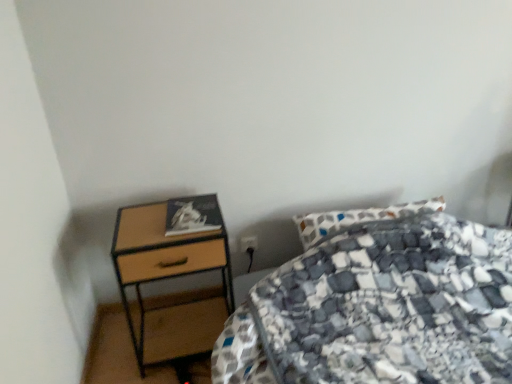
Question: Is patterned fabric bed at center next to black plastic power plug at lower center?

Choices:
 (A) no
 (B) yes

Answer: (A)

Question: Does patterned fabric bed at center appear on the left side of black plastic power plug at lower center?

Choices:
 (A) yes
 (B) no

Answer: (B)

Question: Does patterned fabric bed at center have a lesser width compared to black plastic power plug at lower center?

Choices:
 (A) yes
 (B) no

Answer: (B)

Question: Considering the relative sizes of patterned fabric bed at center and black plastic power plug at lower center in the image provided, is patterned fabric bed at center wider than black plastic power plug at lower center?

Choices:
 (A) no
 (B) yes

Answer: (B)

Question: Can you confirm if patterned fabric bed at center is smaller than black plastic power plug at lower center?

Choices:
 (A) no
 (B) yes

Answer: (A)

Question: Considering the positions of point [x=181, y=253] and point [x=241, y=243], is point [x=181, y=253] closer or farther from the camera than point [x=241, y=243]?

Choices:
 (A) farther
 (B) closer

Answer: (B)

Question: In terms of width, does woodenmaterial/texturenightstand at left look wider or thinner when compared to black plastic power plug at lower center?

Choices:
 (A) wide
 (B) thin

Answer: (A)

Question: Visually, is woodenmaterial/texturenightstand at left positioned to the left or to the right of black plastic power plug at lower center?

Choices:
 (A) left
 (B) right

Answer: (A)

Question: Is woodenmaterial/texturenightstand at left inside or outside of black plastic power plug at lower center?

Choices:
 (A) outside
 (B) inside

Answer: (A)

Question: Relative to patterned fabric bed at center, is black plastic power plug at lower center in front or behind?

Choices:
 (A) behind
 (B) front

Answer: (A)

Question: From the image's perspective, is black plastic power plug at lower center above or below patterned fabric bed at center?

Choices:
 (A) below
 (B) above

Answer: (B)

Question: Choose the correct answer: Is black plastic power plug at lower center inside patterned fabric bed at center or outside it?

Choices:
 (A) outside
 (B) inside

Answer: (A)

Question: In terms of width, does black plastic power plug at lower center look wider or thinner when compared to patterned fabric bed at center?

Choices:
 (A) thin
 (B) wide

Answer: (A)

Question: Is patterned fabric bed at center in front of or behind black plastic power plug at lower center in the image?

Choices:
 (A) behind
 (B) front

Answer: (B)

Question: Based on their positions, is patterned fabric bed at center located to the left or right of black plastic power plug at lower center?

Choices:
 (A) left
 (B) right

Answer: (B)